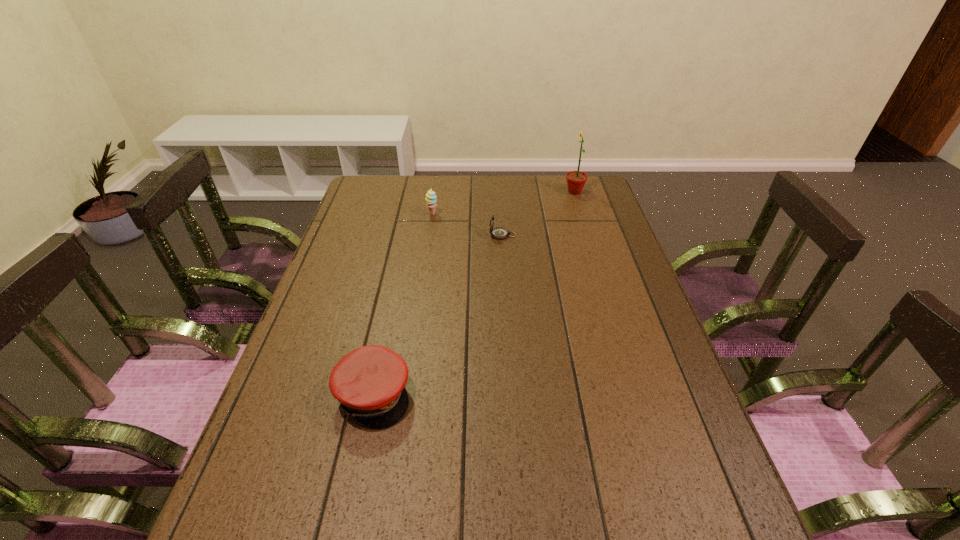
Find the location of a particular element. blank space at the left edge of the desktop is located at coordinates (328, 312).

This screenshot has width=960, height=540. Find the location of `vacant space at the right edge`. vacant space at the right edge is located at coordinates tap(614, 285).

The width and height of the screenshot is (960, 540). I want to click on vacant space at the far left corner, so click(360, 187).

You are a GUI agent. You are given a task and a screenshot of the screen. Output one action in this format:
    pyautogui.click(x=<x>, y=<y>)
    Task: Click on the vacant space at the far right corner
    
    Given the screenshot: What is the action you would take?
    pyautogui.click(x=561, y=177)

The width and height of the screenshot is (960, 540). Find the location of `vacant space in between the tallest object and the sherbert`. vacant space in between the tallest object and the sherbert is located at coordinates (x=503, y=203).

Locate an element on the screen. free point between the third farthest object and the tallest object is located at coordinates (539, 213).

You are a GUI agent. You are given a task and a screenshot of the screen. Output one action in this format:
    pyautogui.click(x=<x>, y=<y>)
    Task: Click on the vacant area that lies between the sherbert and the tallest object
    
    Given the screenshot: What is the action you would take?
    pyautogui.click(x=503, y=203)

The width and height of the screenshot is (960, 540). Find the location of `unoccupied area between the cap and the sherbert`. unoccupied area between the cap and the sherbert is located at coordinates (403, 305).

Locate an element on the screen. The height and width of the screenshot is (540, 960). vacant space in between the cap and the sunflower is located at coordinates (474, 293).

Identify the location of free spot between the third object from left to right and the nearest object. (438, 315).